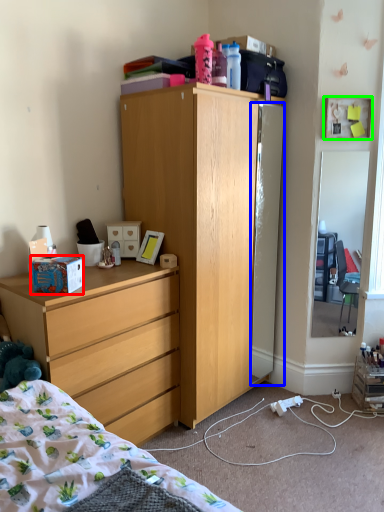
Question: Considering the real-world distances, which object is farthest from box (highlighted by a red box)? refrigerator (highlighted by a blue box) or picture frame (highlighted by a green box)?

Choices:
 (A) refrigerator
 (B) picture frame

Answer: (B)